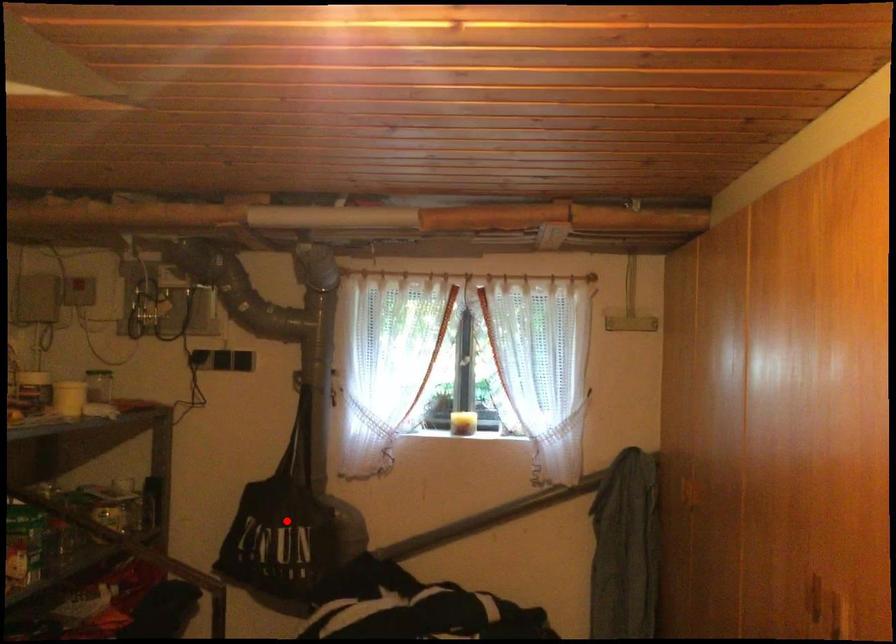
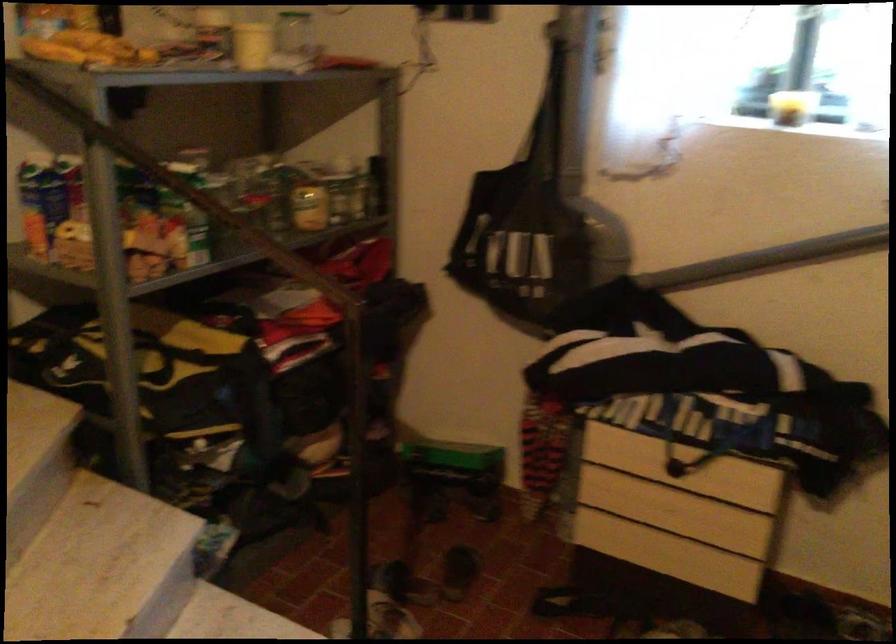
Question: I am providing you with two images of the same scene from different viewpoints. Given a red point in image1, look at the same physical point in image2. Is it:

Choices:
 (A) Closer to the viewpoint
 (B) Farther from the viewpoint

Answer: (A)